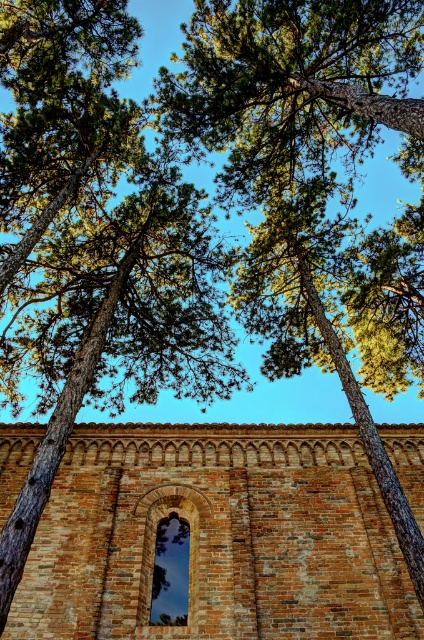
Question: Does brown brick church at center have a greater width compared to dark glass window at center?

Choices:
 (A) no
 (B) yes

Answer: (B)

Question: Is the position of brown brick church at center less distant than that of dark glass window at center?

Choices:
 (A) no
 (B) yes

Answer: (B)

Question: Does brown brick church at center appear on the right side of dark glass window at center?

Choices:
 (A) yes
 (B) no

Answer: (A)